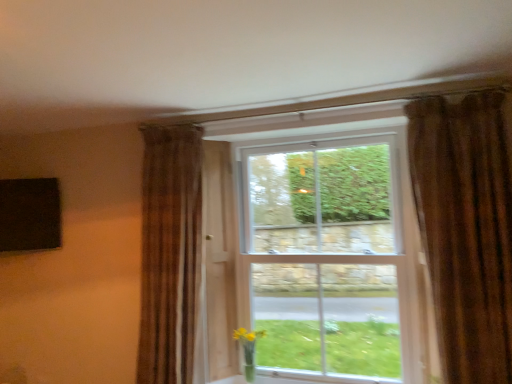
Question: Considering the relative positions of brown textured curtain at upper right, the first curtain viewed from the front, and translucent glass vase at lower right in the image provided, is brown textured curtain at upper right, the first curtain viewed from the front, to the left of translucent glass vase at lower right from the viewer's perspective?

Choices:
 (A) no
 (B) yes

Answer: (A)

Question: Is brown textured curtain at upper right, which is the second curtain from back to front, behind translucent glass vase at lower right?

Choices:
 (A) no
 (B) yes

Answer: (A)

Question: Is brown textured curtain at upper right, which is the second curtain from back to front, outside translucent glass vase at lower right?

Choices:
 (A) no
 (B) yes

Answer: (B)

Question: From a real-world perspective, is brown textured curtain at upper right, the first curtain viewed from the front, beneath translucent glass vase at lower right?

Choices:
 (A) no
 (B) yes

Answer: (A)

Question: From a real-world perspective, is brown textured curtain at upper right, which is the second curtain from back to front, over translucent glass vase at lower right?

Choices:
 (A) yes
 (B) no

Answer: (A)

Question: Is brown textured curtain at left, marked as the first curtain in a left-to-right arrangement, shorter than brown textured curtain at upper right, the first curtain viewed from the front?

Choices:
 (A) yes
 (B) no

Answer: (B)

Question: Is brown textured curtain at left, which is the second curtain from front to back, facing away from brown textured curtain at upper right, positioned as the first curtain in right-to-left order?

Choices:
 (A) no
 (B) yes

Answer: (A)

Question: From a real-world perspective, is brown textured curtain at left, positioned as the first curtain in back-to-front order, under brown textured curtain at upper right, positioned as the first curtain in right-to-left order?

Choices:
 (A) yes
 (B) no

Answer: (A)

Question: Is brown textured curtain at upper right, the first curtain viewed from the front, a part of brown textured curtain at left, marked as the first curtain in a left-to-right arrangement?

Choices:
 (A) no
 (B) yes

Answer: (A)

Question: From a real-world perspective, is brown textured curtain at left, which appears as the second curtain when viewed from the right, over brown textured curtain at upper right, the first curtain viewed from the front?

Choices:
 (A) no
 (B) yes

Answer: (A)

Question: Are brown textured curtain at left, marked as the first curtain in a left-to-right arrangement, and brown textured curtain at upper right, the first curtain viewed from the front, located far from each other?

Choices:
 (A) yes
 (B) no

Answer: (A)

Question: From the image's perspective, is brown textured curtain at left, which appears as the second curtain when viewed from the right, beneath translucent glass vase at lower right?

Choices:
 (A) yes
 (B) no

Answer: (B)